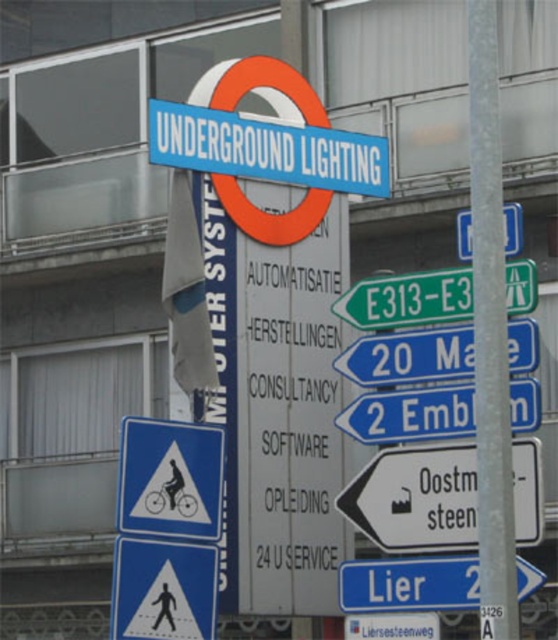
Question: Is blue plastic road sign at center positioned behind white plastic sign at lower center?

Choices:
 (A) no
 (B) yes

Answer: (A)

Question: Does blue plastic sign at lower right have a larger size compared to white plastic sign at upper center?

Choices:
 (A) yes
 (B) no

Answer: (B)

Question: Which point is farther to the camera?

Choices:
 (A) (519, 269)
 (B) (506, 220)

Answer: (A)

Question: Can you confirm if white plastic sign at lower right is bigger than white plastic road sign at center?

Choices:
 (A) no
 (B) yes

Answer: (B)

Question: Estimate the real-world distances between objects in this image. Which object is closer to the blue plastic bicycle sign at lower left?

Choices:
 (A) white plastic sign at upper center
 (B) white plastic sign at lower right
 (C) silver metallic pole at center

Answer: (B)

Question: Which point is farther to the camera?

Choices:
 (A) white plastic sign at lower right
 (B) white plastic sign at upper center
 (C) green plastic road sign at center
 (D) blue plastic bicycle sign at lower left

Answer: (D)